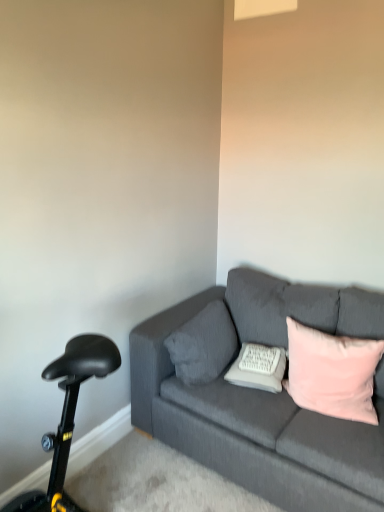
Question: From a real-world perspective, is textured gray pillow at center, which is counted as the 3th pillow, starting from the right, physically above pink velvet pillow at right, the third pillow in the left-to-right sequence?

Choices:
 (A) yes
 (B) no

Answer: (A)

Question: Is textured gray pillow at center, the first pillow when ordered from left to right, next to pink velvet pillow at right, marked as the first pillow in a right-to-left arrangement, and touching it?

Choices:
 (A) yes
 (B) no

Answer: (B)

Question: From the image's perspective, is textured gray pillow at center, the first pillow when ordered from left to right, beneath pink velvet pillow at right, the third pillow in the left-to-right sequence?

Choices:
 (A) no
 (B) yes

Answer: (A)

Question: Is textured gray pillow at center, the first pillow when ordered from left to right, not inside pink velvet pillow at right, marked as the first pillow in a right-to-left arrangement?

Choices:
 (A) no
 (B) yes

Answer: (B)

Question: Can you confirm if textured gray pillow at center, which is counted as the 3th pillow, starting from the right, is bigger than pink velvet pillow at right, marked as the first pillow in a right-to-left arrangement?

Choices:
 (A) no
 (B) yes

Answer: (A)

Question: Do you think textured gray pillow at center, the first pillow when ordered from left to right, is within black plastic bicycle at lower left, or outside of it?

Choices:
 (A) inside
 (B) outside

Answer: (B)

Question: From the image's perspective, is textured gray pillow at center, the first pillow when ordered from left to right, located above or below black plastic bicycle at lower left?

Choices:
 (A) below
 (B) above

Answer: (B)

Question: Considering the positions of textured gray pillow at center, which is counted as the 3th pillow, starting from the right, and black plastic bicycle at lower left in the image, is textured gray pillow at center, which is counted as the 3th pillow, starting from the right, taller or shorter than black plastic bicycle at lower left?

Choices:
 (A) tall
 (B) short

Answer: (A)

Question: Relative to black plastic bicycle at lower left, is textured gray pillow at center, the first pillow when ordered from left to right, in front or behind?

Choices:
 (A) behind
 (B) front

Answer: (A)

Question: In the image, is pink velvet pillow at right, marked as the first pillow in a right-to-left arrangement, on the left side or the right side of textured gray pillow at center, which is counted as the 3th pillow, starting from the right?

Choices:
 (A) left
 (B) right

Answer: (B)

Question: Relative to textured gray pillow at center, the first pillow when ordered from left to right, is pink velvet pillow at right, marked as the first pillow in a right-to-left arrangement, in front or behind?

Choices:
 (A) front
 (B) behind

Answer: (A)

Question: Does point (291, 322) appear closer or farther from the camera than point (187, 351)?

Choices:
 (A) closer
 (B) farther

Answer: (B)

Question: Which is correct: pink velvet pillow at right, marked as the first pillow in a right-to-left arrangement, is inside textured gray pillow at center, the first pillow when ordered from left to right, or outside of it?

Choices:
 (A) outside
 (B) inside

Answer: (A)

Question: From a real-world perspective, relative to white textured pillow at center, the second pillow positioned from the left, is black plastic bicycle at lower left vertically above or below?

Choices:
 (A) below
 (B) above

Answer: (A)

Question: Considering their positions, is black plastic bicycle at lower left located in front of or behind white textured pillow at center, the second pillow positioned from the left?

Choices:
 (A) behind
 (B) front

Answer: (B)